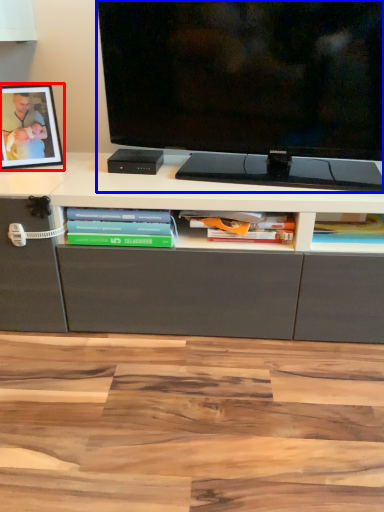
Question: Which point is further to the camera, picture frame (highlighted by a red box) or television (highlighted by a blue box)?

Choices:
 (A) picture frame
 (B) television

Answer: (A)